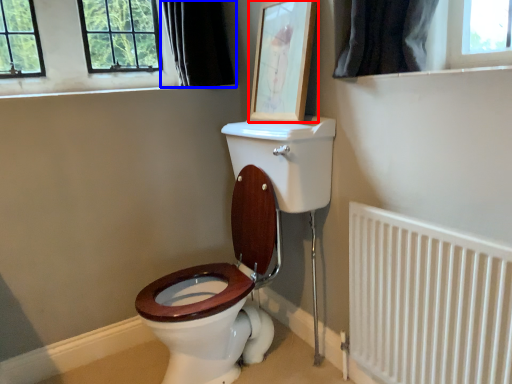
Question: Which object appears farthest to the camera in this image, picture frame (highlighted by a red box) or curtain (highlighted by a blue box)?

Choices:
 (A) picture frame
 (B) curtain

Answer: (B)